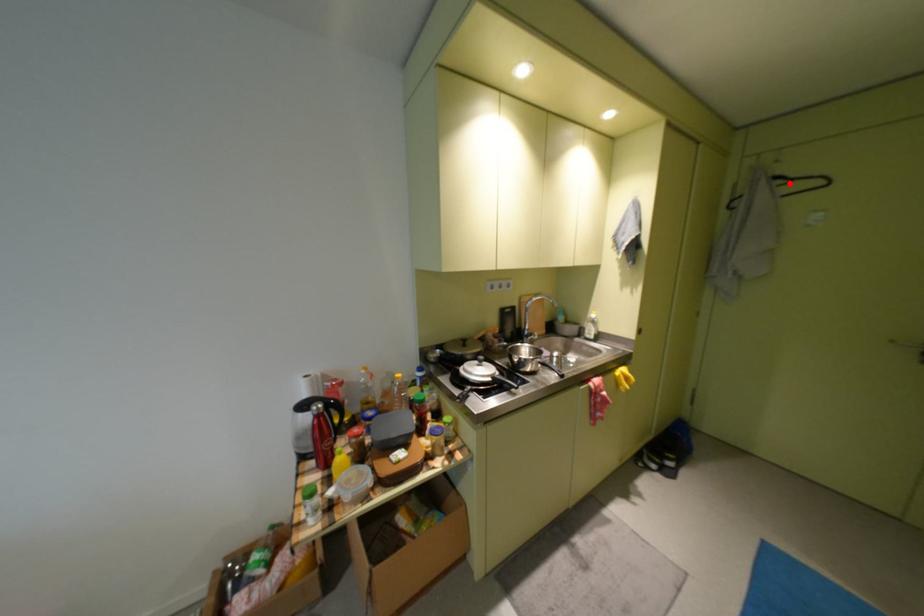
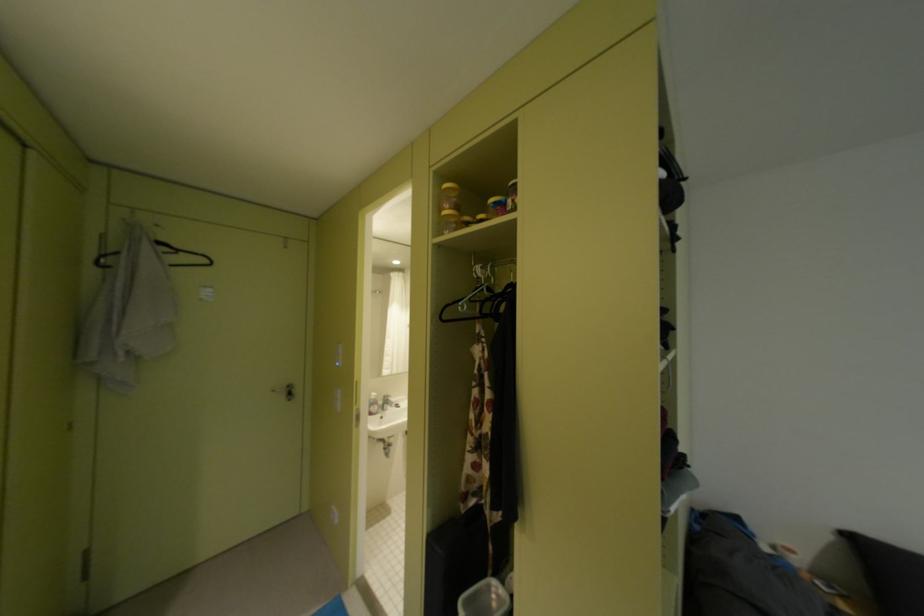
In the second image, find the point that corresponds to the highlighted location in the first image.

(175, 249)